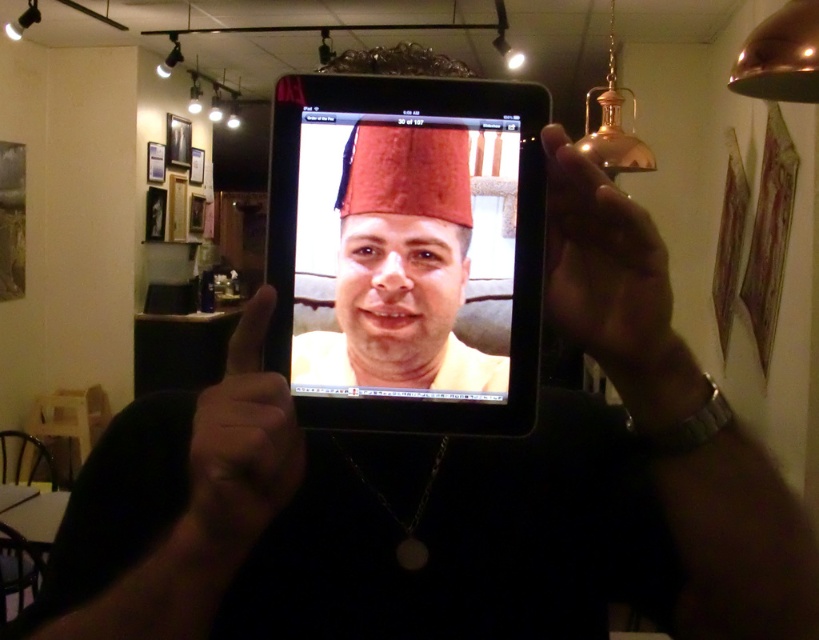
You are a person with a 4.5 inches long hand. You want to hold a matte black tablet at center in front of your face using your matte black hand at center. Can your hand reach the tablet?

The distance between the matte black tablet at center and the matte black hand at center is 4.01 inches. Since your hand is 4.5 inches long, it can comfortably reach and hold the matte black tablet at center.

You are designing a layout for a digital photo frame that needs to display both the matte black tablet at center and the gold metallic hand at upper right. Based on their sizes, which object should be scaled down to ensure they both fit within the frame without overlapping?

The gold metallic hand at upper right should be scaled down because it occupies more space than the matte black tablet at center, so reducing its size would allow both to fit without overlapping.